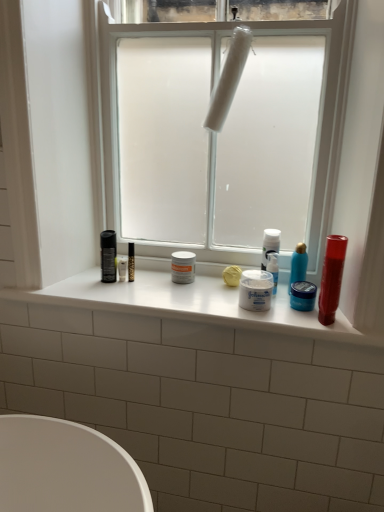
Question: Could white frosted glass window at center be considered to be inside white glossy window sill at center?

Choices:
 (A) yes
 (B) no

Answer: (B)

Question: From a real-world perspective, is white glossy window sill at center located higher than white frosted glass window at center?

Choices:
 (A) no
 (B) yes

Answer: (A)

Question: Is white glossy window sill at center outside of white frosted glass window at center?

Choices:
 (A) no
 (B) yes

Answer: (B)

Question: Is white glossy window sill at center next to white frosted glass window at center and touching it?

Choices:
 (A) no
 (B) yes

Answer: (A)

Question: Is white glossy window sill at center bigger than white frosted glass window at center?

Choices:
 (A) yes
 (B) no

Answer: (B)

Question: From the image's perspective, is white matte jar at center, which appears as the 2th toiletry when viewed from the left, located above or below white matte plastic at center?

Choices:
 (A) above
 (B) below

Answer: (B)

Question: Is point (248, 279) positioned closer to the camera than point (233, 190)?

Choices:
 (A) closer
 (B) farther

Answer: (A)

Question: Is white matte jar at center, which appears as the 2th toiletry when viewed from the left, wider or thinner than white matte plastic at center?

Choices:
 (A) wide
 (B) thin

Answer: (B)

Question: Is white matte jar at center, the third toiletry positioned from the right, spatially inside white matte plastic at center, or outside of it?

Choices:
 (A) inside
 (B) outside

Answer: (B)

Question: From the image's perspective, relative to white matte jar at center, placed as the 4th toiletry when sorted from right to left, is white matte jar at center, the third toiletry positioned from the right, above or below?

Choices:
 (A) above
 (B) below

Answer: (B)

Question: In terms of width, does white matte jar at center, which appears as the 2th toiletry when viewed from the left, look wider or thinner when compared to white matte jar at center, positioned as the first toiletry in left-to-right order?

Choices:
 (A) wide
 (B) thin

Answer: (A)

Question: From a real-world perspective, relative to white matte jar at center, positioned as the first toiletry in left-to-right order, is white matte jar at center, the third toiletry positioned from the right, vertically above or below?

Choices:
 (A) below
 (B) above

Answer: (B)

Question: Considering the positions of white matte jar at center, which appears as the 2th toiletry when viewed from the left, and white matte jar at center, placed as the 4th toiletry when sorted from right to left, in the image, is white matte jar at center, which appears as the 2th toiletry when viewed from the left, taller or shorter than white matte jar at center, placed as the 4th toiletry when sorted from right to left,?

Choices:
 (A) short
 (B) tall

Answer: (A)

Question: From the image's perspective, is blue matte jar at center, which is the third toiletry in left-to-right order, above or below white matte jar at center, positioned as the first toiletry in left-to-right order?

Choices:
 (A) below
 (B) above

Answer: (A)

Question: Is blue matte jar at center, which is the third toiletry in left-to-right order, inside or outside of white matte jar at center, positioned as the first toiletry in left-to-right order?

Choices:
 (A) outside
 (B) inside

Answer: (A)